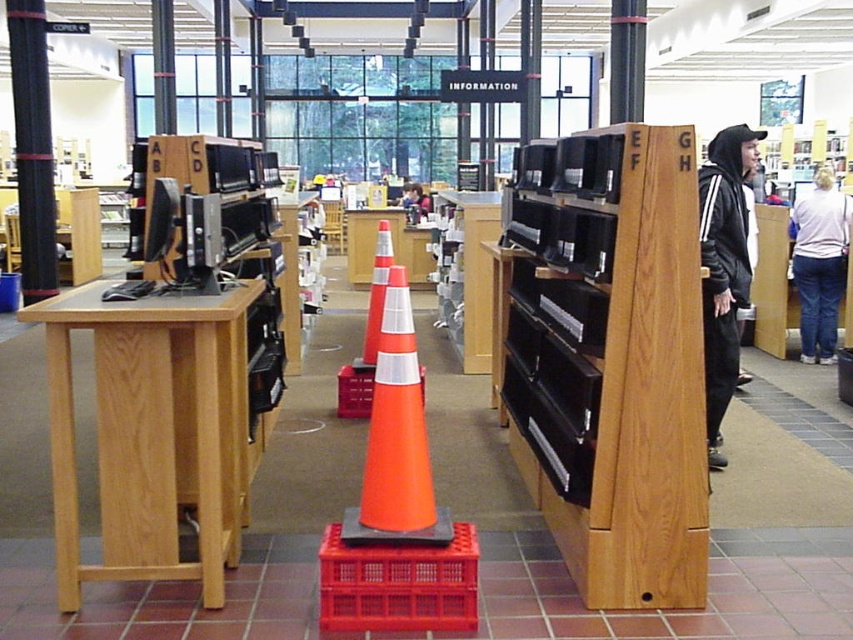
You are a janitor in the library and need to determine if the orange matte traffic cone at center can fit into a storage bin that is the same height as the white cotton shirt at upper right. Can it fit?

The orange matte traffic cone at center is not as tall as the white cotton shirt at upper right, so it can fit into the storage bin with the same height as the white cotton shirt at upper right.

You are a visitor in the library and you see the black hoodie at right. Where is it located in the image?

The black hoodie at right is located at point 0.419 on the x axis and 0.849 on the y axis.

You are a janitor in the library and need to clean the area around the matte orange cone at center and the smooth skin face at center. Which object takes up more space and requires more room to clean around it?

The smooth skin face at center takes up more space than the matte orange cone at center, so it requires more room to clean around it.